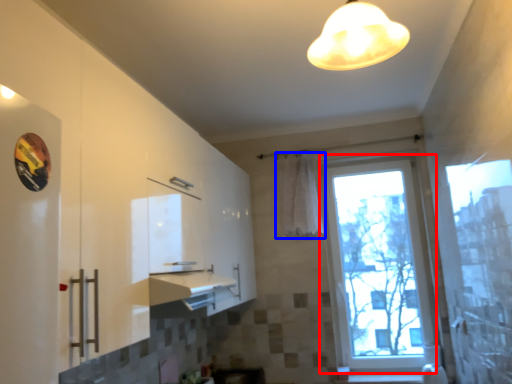
Question: Which point is closer to the camera, window (highlighted by a red box) or curtain (highlighted by a blue box)?

Choices:
 (A) window
 (B) curtain

Answer: (A)